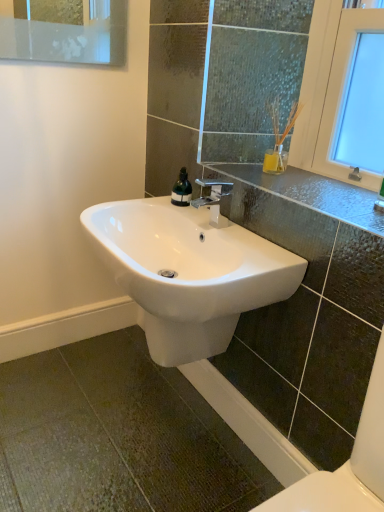
This screenshot has width=384, height=512. I want to click on blank space situated above glossy ceramic sink at center (from a real-world perspective), so click(x=284, y=176).